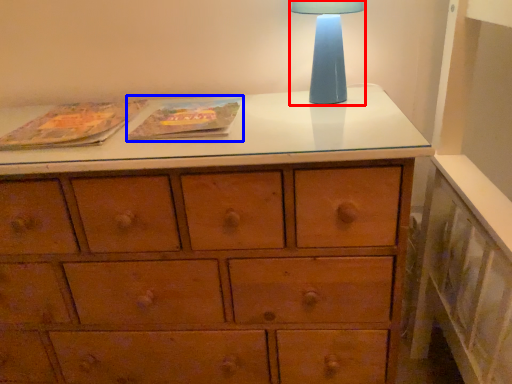
Question: Which of the following is the farthest to the observer, table lamp (highlighted by a red box) or paperback book (highlighted by a blue box)?

Choices:
 (A) table lamp
 (B) paperback book

Answer: (A)